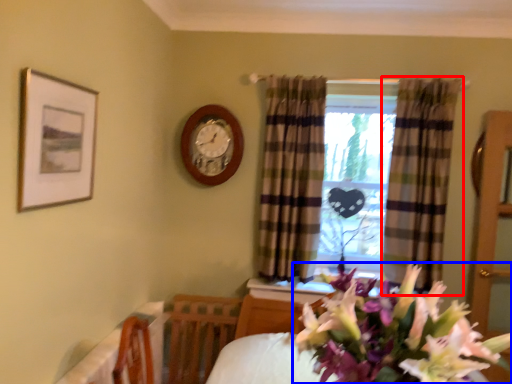
Question: Among these objects, which one is nearest to the camera, curtain (highlighted by a red box) or flower (highlighted by a blue box)?

Choices:
 (A) curtain
 (B) flower

Answer: (B)